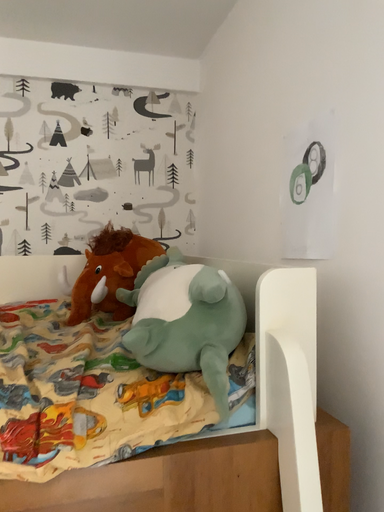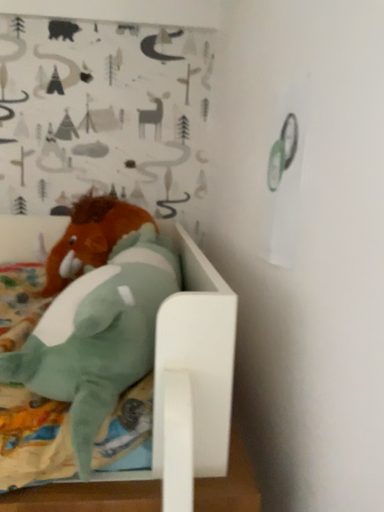
Question: Which way did the camera rotate in the video?

Choices:
 (A) rotated left
 (B) rotated right

Answer: (A)